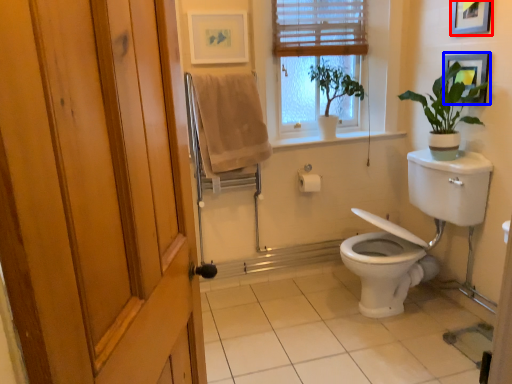
Question: Among these objects, which one is farthest to the camera, picture frame (highlighted by a red box) or picture frame (highlighted by a blue box)?

Choices:
 (A) picture frame
 (B) picture frame

Answer: (B)